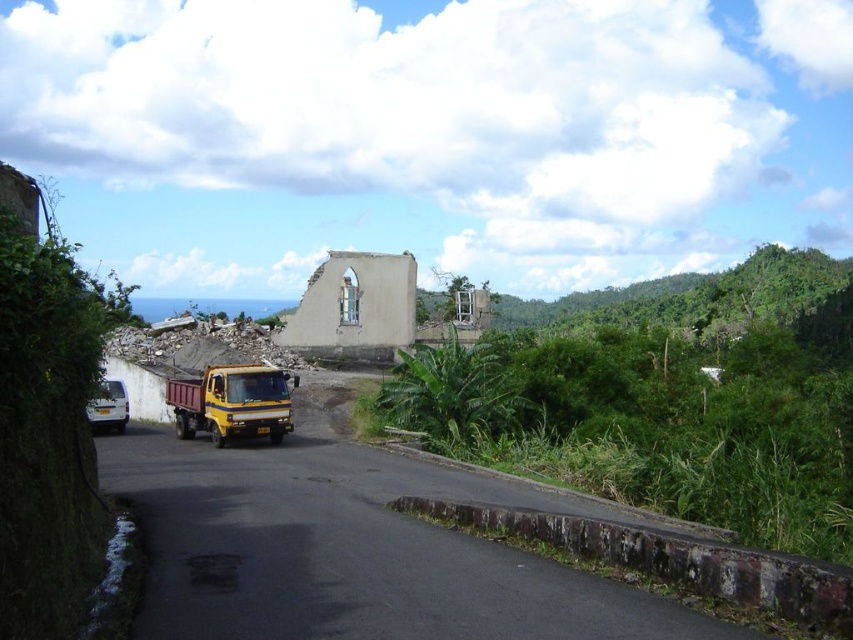
Question: Is green leafy vegetation at center right below yellow matte truck at center?

Choices:
 (A) no
 (B) yes

Answer: (A)

Question: Considering the real-world distances, which object is farthest from the white matte van at left?

Choices:
 (A) yellow matte truck at center
 (B) green leafy vegetation at center right

Answer: (B)

Question: Is green leafy vegetation at center right to the left of yellow matte truck at center from the viewer's perspective?

Choices:
 (A) yes
 (B) no

Answer: (B)

Question: Does green leafy vegetation at center right have a smaller size compared to yellow matte truck at center?

Choices:
 (A) no
 (B) yes

Answer: (A)

Question: Considering the real-world distances, which object is closest to the yellow matte truck at center?

Choices:
 (A) white matte van at left
 (B) green leafy vegetation at center right

Answer: (A)

Question: Which object is the closest to the green leafy vegetation at center right?

Choices:
 (A) white matte van at left
 (B) yellow matte truck at center

Answer: (B)